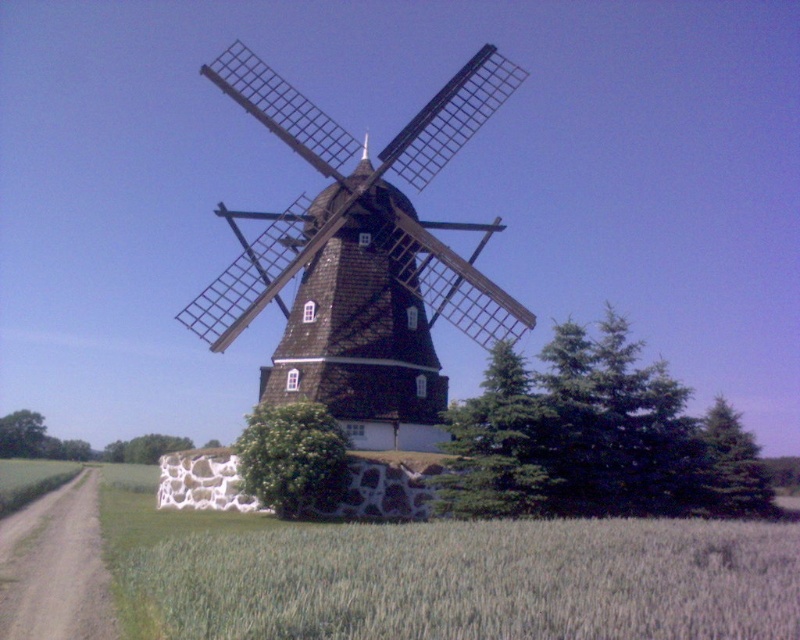
Which is above, green grassy wheat field at lower left or green leafy tree at lower left?

green grassy wheat field at lower left

I want to click on green grassy wheat field at lower left, so click(448, 577).

Is dark brown wood windmill at center further to the viewer compared to green leafy tree at lower left?

That is False.

Where is `dark brown wood windmill at center`? The width and height of the screenshot is (800, 640). dark brown wood windmill at center is located at coordinates (362, 259).

Between point (274, 129) and point (114, 460), which one is positioned behind?

Point (114, 460)

I want to click on dark brown wood windmill at center, so click(x=362, y=259).

Is dark brown wood windmill at center to the right of green leafy bush at center from the viewer's perspective?

Correct, you'll find dark brown wood windmill at center to the right of green leafy bush at center.

In the scene shown: Who is more forward, (x=249, y=273) or (x=278, y=451)?

Point (x=278, y=451) is more forward.

Does point (448, 100) lie behind point (272, 504)?

Yes, point (448, 100) is behind point (272, 504).

The image size is (800, 640). In order to click on dark brown wood windmill at center in this screenshot , I will do `click(362, 259)`.